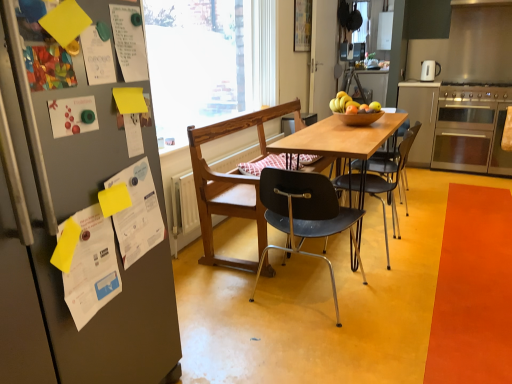
I want to click on vacant area located to the right-hand side of wooden table at center, so click(x=446, y=221).